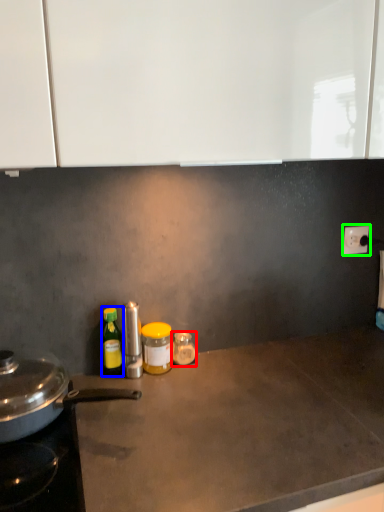
Question: Based on their relative distances, which object is nearer to bottle (highlighted by a red box)? Choose from bottle (highlighted by a blue box) and electric outlet (highlighted by a green box).

Choices:
 (A) bottle
 (B) electric outlet

Answer: (A)